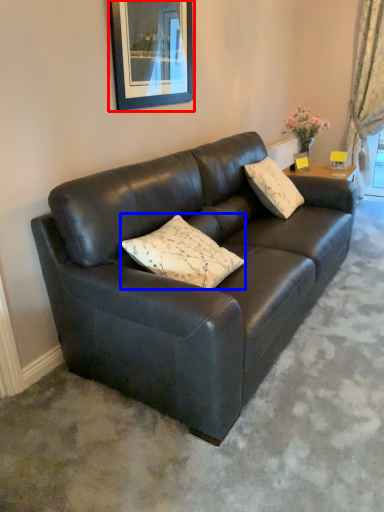
Question: Which object appears farthest to the camera in this image, picture frame (highlighted by a red box) or pillow (highlighted by a blue box)?

Choices:
 (A) picture frame
 (B) pillow

Answer: (A)